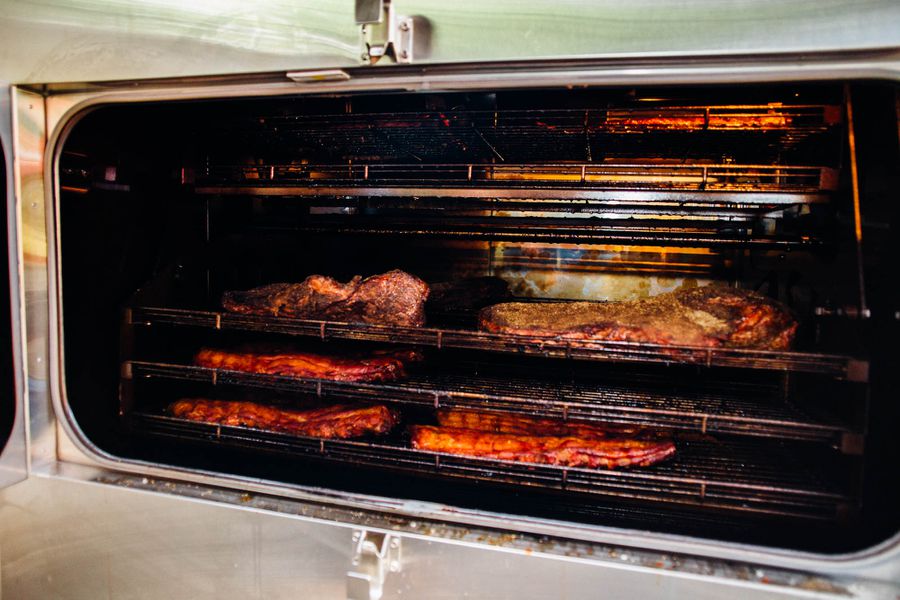
At what (x,y) coordinates should I click in order to perform the action: click on top hinge. Please return your answer as a coordinate pair (x, y). Image resolution: width=900 pixels, height=600 pixels. Looking at the image, I should click on (376, 43).